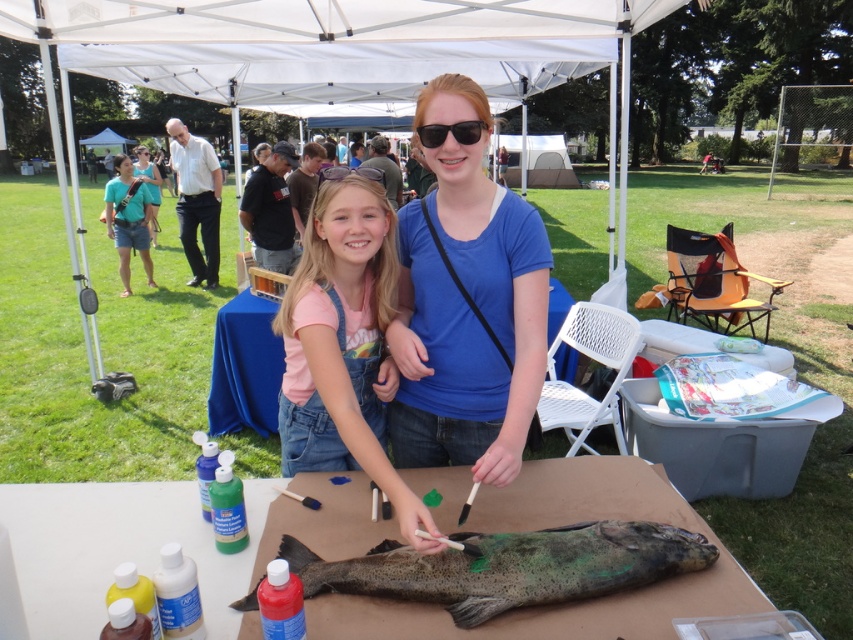
Is blue cotton shirt at center bigger than matte cardboard table at center?

Correct, blue cotton shirt at center is larger in size than matte cardboard table at center.

Which is behind, point (450, 458) or point (264, 342)?

Positioned behind is point (264, 342).

What are the coordinates of `blue cotton shirt at center` in the screenshot? It's located at (466, 305).

You are a GUI agent. You are given a task and a screenshot of the screen. Output one action in this format:
    pyautogui.click(x=<x>, y=<y>)
    Task: Click on the blue cotton shirt at center
    
    Given the screenshot: What is the action you would take?
    pyautogui.click(x=466, y=305)

Which is above, white fabric canopy at upper center or pink denim overalls at center?

white fabric canopy at upper center is above.

Is white fabric canopy at upper center wider than pink denim overalls at center?

Yes.

The height and width of the screenshot is (640, 853). Describe the element at coordinates (303, 29) in the screenshot. I see `white fabric canopy at upper center` at that location.

The width and height of the screenshot is (853, 640). In order to click on white fabric canopy at upper center in this screenshot , I will do `click(303, 29)`.

Does point (305, 531) lie in front of point (485, 124)?

Yes, it is in front of point (485, 124).

Who is positioned more to the left, smooth cardboard table at center or black plastic goggles at center?

Positioned to the left is smooth cardboard table at center.

Measure the distance between point (x=486, y=625) and camera.

Point (x=486, y=625) and camera are 4.04 feet apart from each other.

What are the coordinates of `smooth cardboard table at center` in the screenshot? It's located at (160, 544).